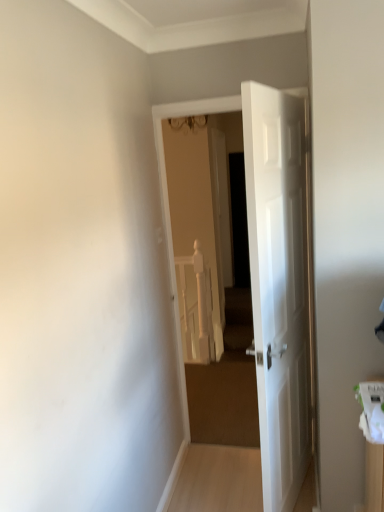
Question: Should I look upward or downward to see white glossy door at center?

Choices:
 (A) up
 (B) down

Answer: (B)